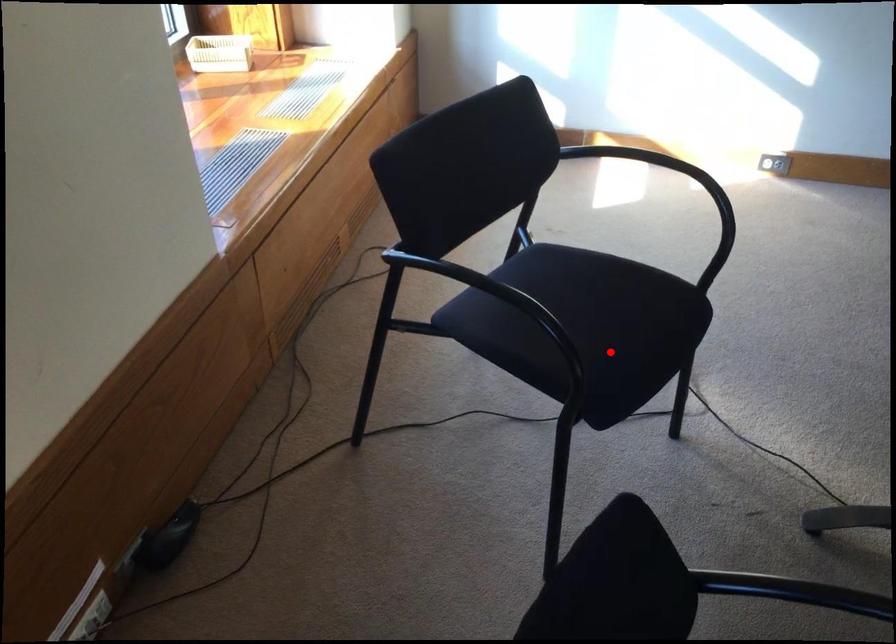
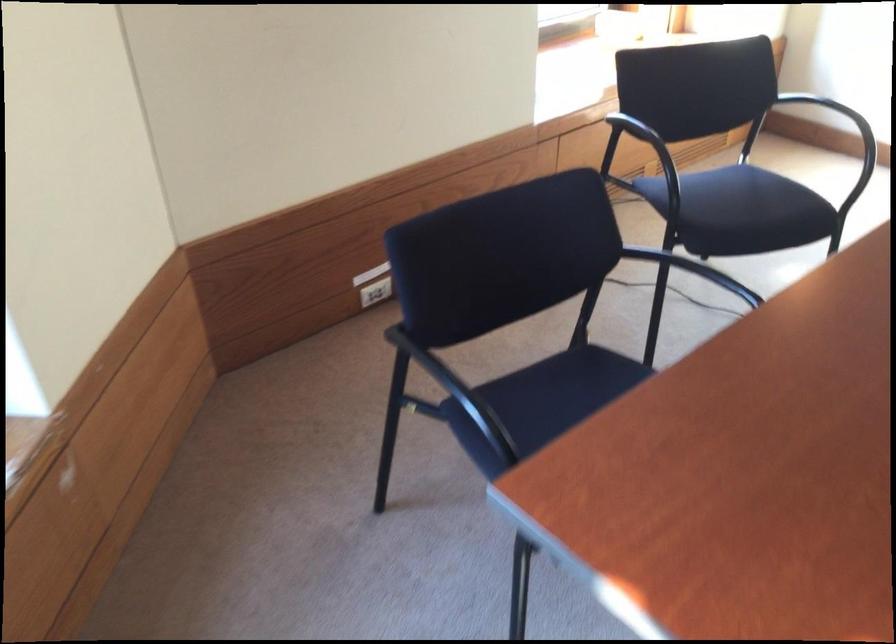
Question: A red point is marked in image1. In image2, is the corresponding 3D point closer to the camera or farther? Reply with the corresponding letter.

Choices:
 (A) The corresponding 3D point is closer.
 (B) The corresponding 3D point is farther.

Answer: (B)